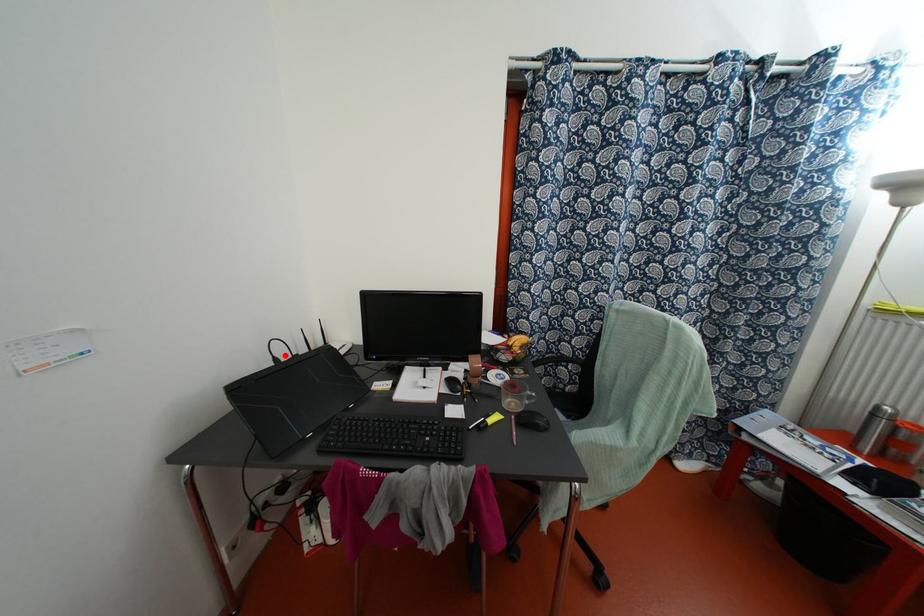
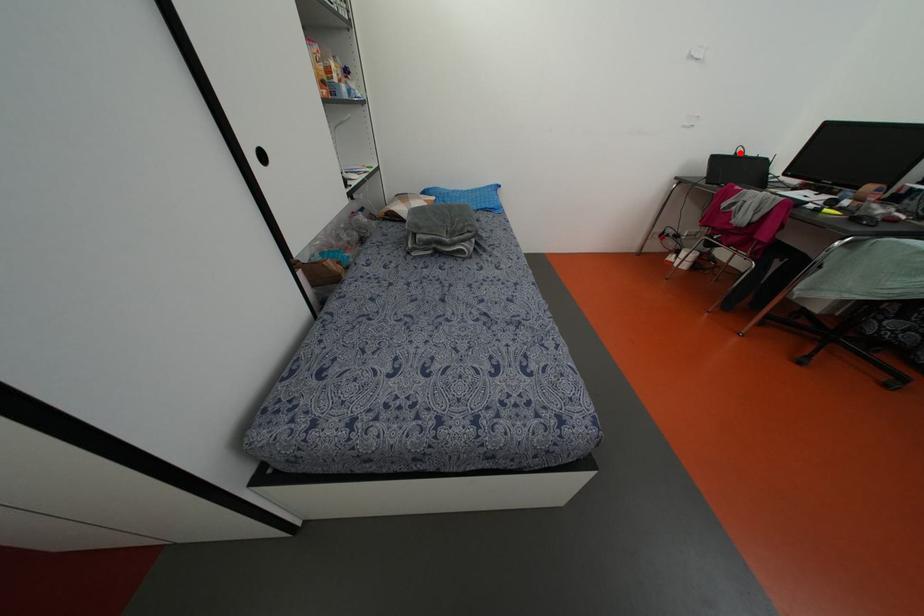
I am providing you with two images of the same scene from different viewpoints. A red point is marked on the first image and another point is marked on the second image. Does the point marked in image1 correspond to the same location as the one in image2?

Yes